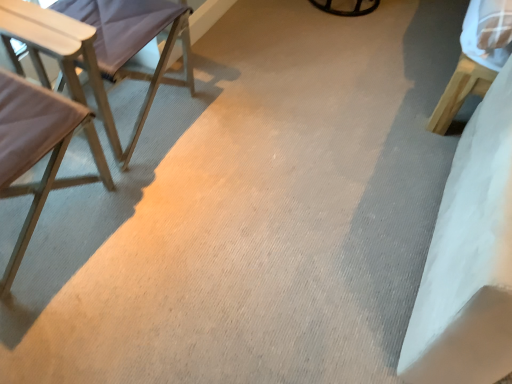
Question: Considering the relative sizes of light beige fabric chair at left, the 1th chair ordered from the bottom, and light purple fabric chair at left, the first chair when ordered from top to bottom, in the image provided, is light beige fabric chair at left, the 1th chair ordered from the bottom, shorter than light purple fabric chair at left, the first chair when ordered from top to bottom,?

Choices:
 (A) no
 (B) yes

Answer: (A)

Question: From the image's perspective, would you say light beige fabric chair at left, the 1th chair ordered from the bottom, is shown under light purple fabric chair at left, placed as the 2th chair when sorted from bottom to top?

Choices:
 (A) yes
 (B) no

Answer: (A)

Question: Is light beige fabric chair at left, the 1th chair ordered from the bottom, looking in the opposite direction of light purple fabric chair at left, placed as the 2th chair when sorted from bottom to top?

Choices:
 (A) no
 (B) yes

Answer: (A)

Question: Is light beige fabric chair at left, the 1th chair ordered from the bottom, taller than light purple fabric chair at left, placed as the 2th chair when sorted from bottom to top?

Choices:
 (A) yes
 (B) no

Answer: (A)

Question: Does light beige fabric chair at left, the 1th chair ordered from the bottom, have a larger size compared to light purple fabric chair at left, placed as the 2th chair when sorted from bottom to top?

Choices:
 (A) no
 (B) yes

Answer: (A)

Question: Is light beige fabric chair at left, the 2th chair in the top-to-bottom sequence, at the right side of light purple fabric chair at left, placed as the 2th chair when sorted from bottom to top?

Choices:
 (A) yes
 (B) no

Answer: (B)

Question: From a real-world perspective, is light purple fabric chair at left, the first chair when ordered from top to bottom, on top of light beige fabric chair at left, the 1th chair ordered from the bottom?

Choices:
 (A) no
 (B) yes

Answer: (A)

Question: Does light purple fabric chair at left, the first chair when ordered from top to bottom, appear on the left side of light beige fabric chair at left, the 1th chair ordered from the bottom?

Choices:
 (A) no
 (B) yes

Answer: (A)

Question: Is light purple fabric chair at left, placed as the 2th chair when sorted from bottom to top, not inside light beige fabric chair at left, the 1th chair ordered from the bottom?

Choices:
 (A) yes
 (B) no

Answer: (A)

Question: Is light purple fabric chair at left, the first chair when ordered from top to bottom, taller than light beige fabric chair at left, the 1th chair ordered from the bottom?

Choices:
 (A) no
 (B) yes

Answer: (A)

Question: Considering the relative sizes of light purple fabric chair at left, the first chair when ordered from top to bottom, and light beige fabric chair at left, the 2th chair in the top-to-bottom sequence, in the image provided, is light purple fabric chair at left, the first chair when ordered from top to bottom, smaller than light beige fabric chair at left, the 2th chair in the top-to-bottom sequence,?

Choices:
 (A) yes
 (B) no

Answer: (B)

Question: Is light purple fabric chair at left, placed as the 2th chair when sorted from bottom to top, far away from light beige fabric chair at left, the 2th chair in the top-to-bottom sequence?

Choices:
 (A) yes
 (B) no

Answer: (B)

Question: Choose the correct answer: Is light beige fabric chair at left, the 1th chair ordered from the bottom, inside light purple fabric chair at left, the first chair when ordered from top to bottom, or outside it?

Choices:
 (A) inside
 (B) outside

Answer: (B)